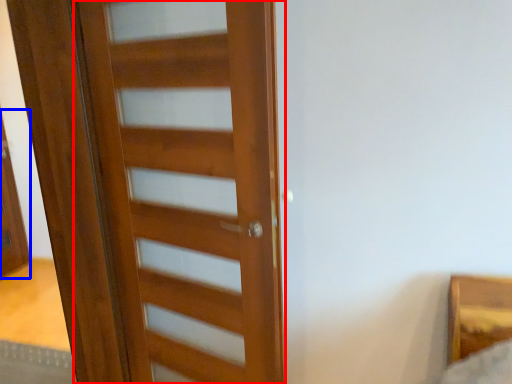
Question: Which object appears farthest to the camera in this image, door (highlighted by a red box) or screen door (highlighted by a blue box)?

Choices:
 (A) door
 (B) screen door

Answer: (B)